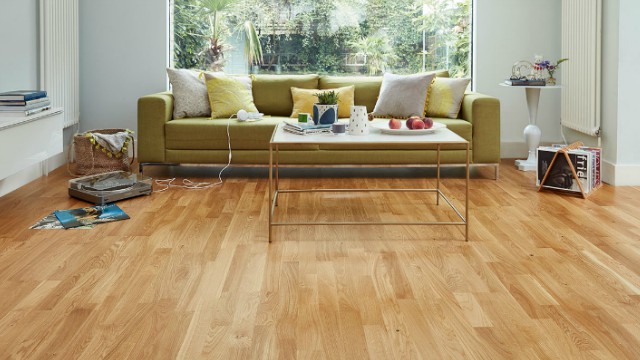
The height and width of the screenshot is (360, 640). In order to click on right armrest in this screenshot , I will do `click(159, 108)`.